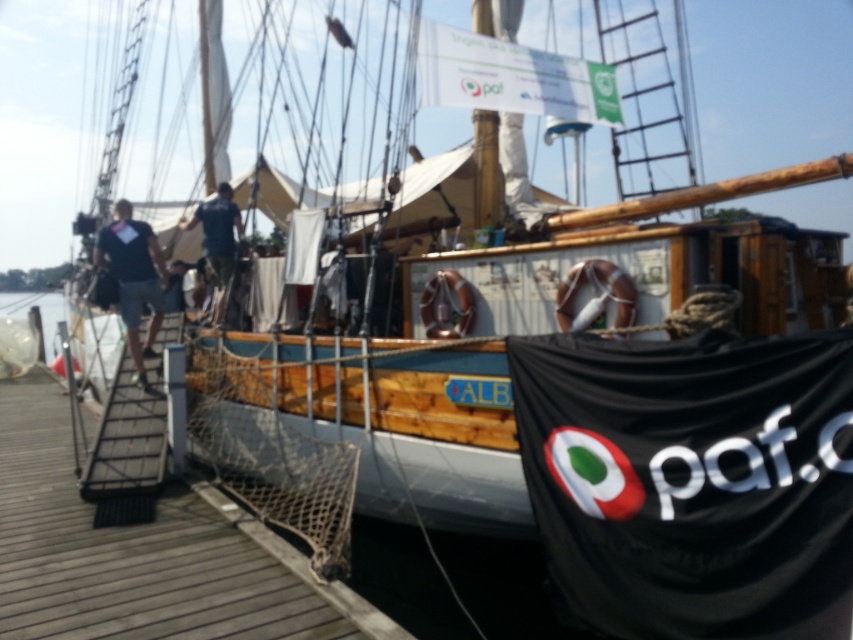
Question: Which point is farther to the camera?

Choices:
 (A) (51, 292)
 (B) (224, 556)

Answer: (A)

Question: Among these objects, which one is nearest to the camera?

Choices:
 (A) wooden at left
 (B) dark blue shirt at left
 (C) clear water at dock left

Answer: (A)

Question: Can you confirm if wooden at left is bigger than dark blue shirt at left?

Choices:
 (A) yes
 (B) no

Answer: (B)

Question: Is wooden at left positioned in front of dark blue shirt at left?

Choices:
 (A) no
 (B) yes

Answer: (B)

Question: Where is dark blue shirt at left located in relation to clear water at dock left in the image?

Choices:
 (A) left
 (B) right

Answer: (B)

Question: Among these objects, which one is nearest to the camera?

Choices:
 (A) clear water at dock left
 (B) wooden at left

Answer: (B)